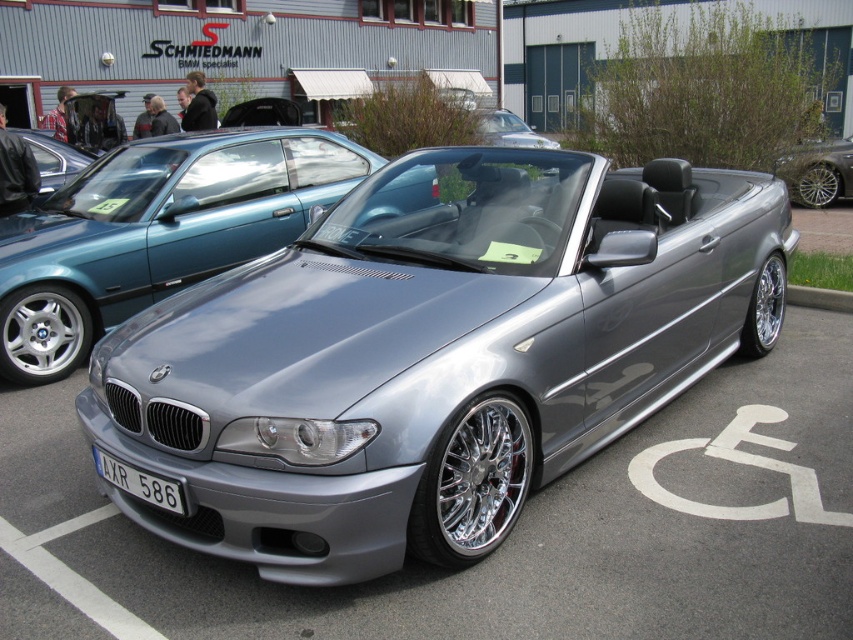
Where is `satin silver convertible at center`? Image resolution: width=853 pixels, height=640 pixels. satin silver convertible at center is located at coordinates (155, 232).

Where is `silver metallic car at right`? The width and height of the screenshot is (853, 640). silver metallic car at right is located at coordinates (817, 172).

At what (x,y) coordinates should I click in order to perform the action: click on silver metallic car at right. Please return your answer as a coordinate pair (x, y). The height and width of the screenshot is (640, 853). Looking at the image, I should click on (817, 172).

Is satin silver convertible at center to the left of silver metallic car at right from the viewer's perspective?

Indeed, satin silver convertible at center is positioned on the left side of silver metallic car at right.

Is point (169, 163) positioned after point (850, 134)?

No.

Identify the location of satin silver convertible at center. This screenshot has width=853, height=640. (155, 232).